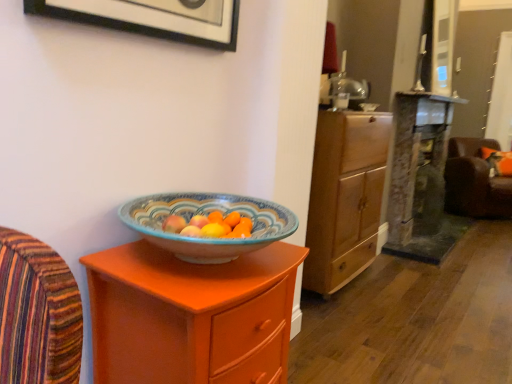
Question: Can you confirm if matte orange cabinet at center is bigger than brown leather swivel chair at right?

Choices:
 (A) no
 (B) yes

Answer: (A)

Question: Considering the relative sizes of matte orange cabinet at center and brown leather swivel chair at right in the image provided, is matte orange cabinet at center thinner than brown leather swivel chair at right?

Choices:
 (A) yes
 (B) no

Answer: (A)

Question: Considering the relative positions of matte orange cabinet at center and brown leather swivel chair at right in the image provided, is matte orange cabinet at center behind brown leather swivel chair at right?

Choices:
 (A) no
 (B) yes

Answer: (A)

Question: From a real-world perspective, is matte orange cabinet at center beneath brown leather swivel chair at right?

Choices:
 (A) yes
 (B) no

Answer: (A)

Question: Is matte orange cabinet at center positioned before brown leather swivel chair at right?

Choices:
 (A) no
 (B) yes

Answer: (B)

Question: From the image's perspective, is brown leather swivel chair at right positioned above or below orange fabric pillow at right?

Choices:
 (A) above
 (B) below

Answer: (B)

Question: Based on their sizes in the image, would you say brown leather swivel chair at right is bigger or smaller than orange fabric pillow at right?

Choices:
 (A) small
 (B) big

Answer: (B)

Question: Is brown leather swivel chair at right inside the boundaries of orange fabric pillow at right, or outside?

Choices:
 (A) inside
 (B) outside

Answer: (B)

Question: Relative to orange fabric pillow at right, is brown leather swivel chair at right in front or behind?

Choices:
 (A) behind
 (B) front

Answer: (B)

Question: Is point (347, 167) closer or farther from the camera than point (192, 36)?

Choices:
 (A) farther
 (B) closer

Answer: (A)

Question: Is wooden cabinet at center taller or shorter than matte black picture frame at upper left?

Choices:
 (A) short
 (B) tall

Answer: (B)

Question: From a real-world perspective, is wooden cabinet at center above or below matte black picture frame at upper left?

Choices:
 (A) above
 (B) below

Answer: (B)

Question: From the image's perspective, relative to matte black picture frame at upper left, is wooden cabinet at center above or below?

Choices:
 (A) above
 (B) below

Answer: (B)

Question: Considering the relative positions of matte orange cabinet at center and brown leather swivel chair at right in the image provided, is matte orange cabinet at center to the left or to the right of brown leather swivel chair at right?

Choices:
 (A) left
 (B) right

Answer: (A)

Question: From the image's perspective, relative to brown leather swivel chair at right, is matte orange cabinet at center above or below?

Choices:
 (A) above
 (B) below

Answer: (B)